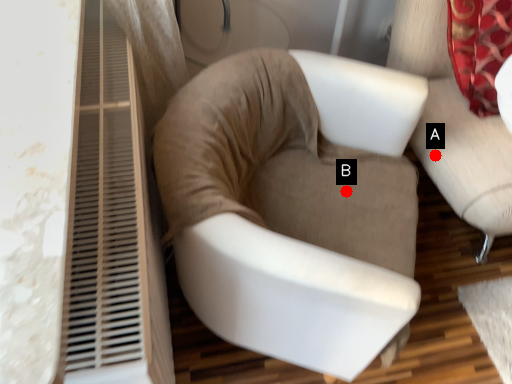
Question: Two points are circled on the image, labeled by A and B beside each circle. Which point is further to the camera?

Choices:
 (A) A is further
 (B) B is further

Answer: (A)